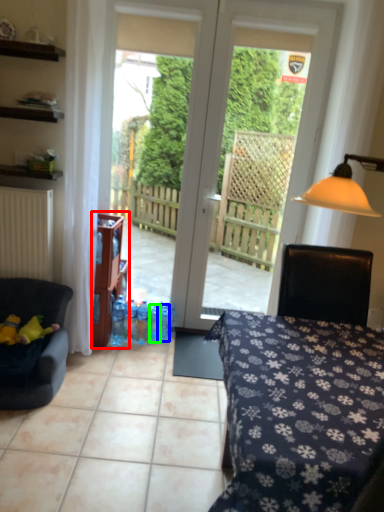
Question: Estimate the real-world distances between objects in this image. Which object is farther from shelf (highlighted by a red box), bottle (highlighted by a blue box) or bottle (highlighted by a green box)?

Choices:
 (A) bottle
 (B) bottle

Answer: (A)